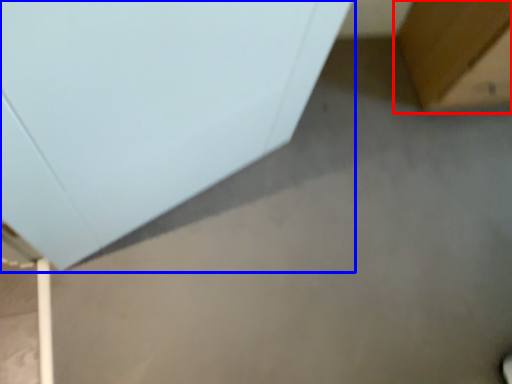
Question: Which object appears closest to the camera in this image, furniture (highlighted by a red box) or furniture (highlighted by a blue box)?

Choices:
 (A) furniture
 (B) furniture

Answer: (B)